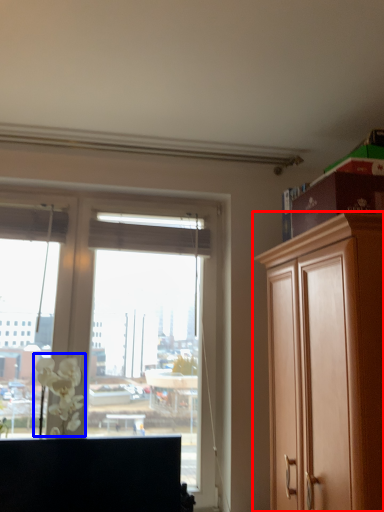
Question: Which of the following is the closest to the observer, cabinetry (highlighted by a red box) or flower (highlighted by a blue box)?

Choices:
 (A) cabinetry
 (B) flower

Answer: (A)